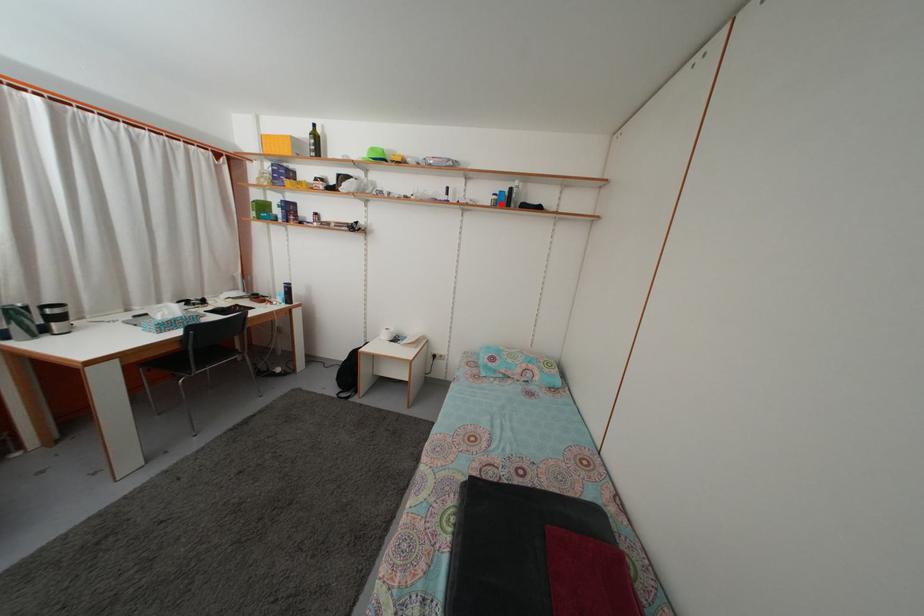
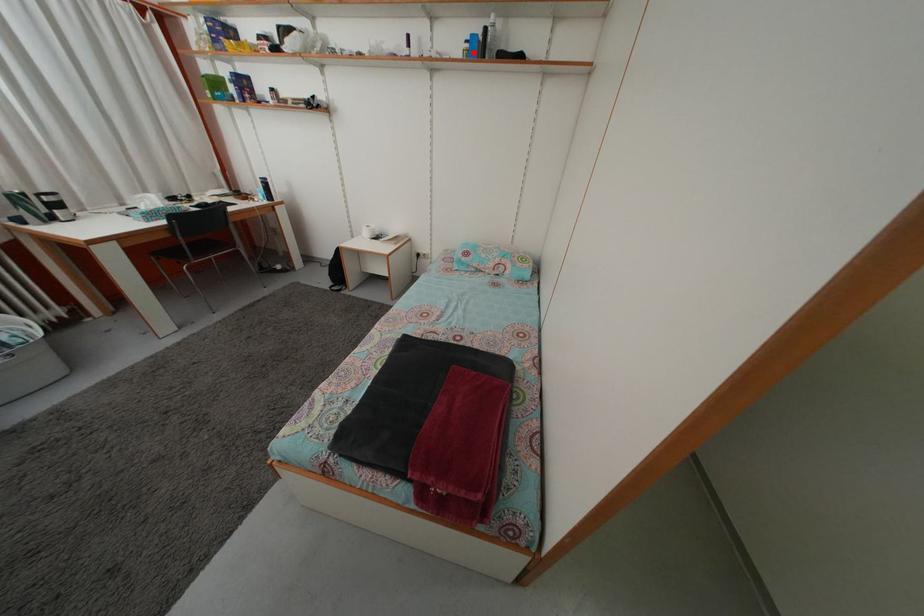
I am providing you with two images of the same scene from different viewpoints. A red point is marked on the first image and another point is marked on the second image. Does the point marked in image1 correspond to the same location as the one in image2?

Yes